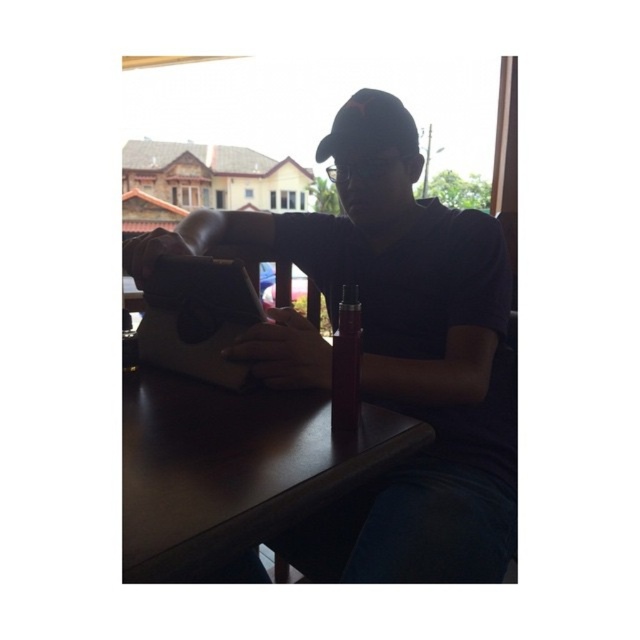
You are a delivery person who needs to place a small package on the dark wood table at center. However, there is a matte black laptop at center already on it. Can you place the package on the table without moving the laptop?

The matte black laptop at center is above the dark wood table at center, so there is space beneath the laptop to place the package. However, since the laptop is already on the table, you would need to move it to make space for the package unless the package can be placed underneath, which might not be practical. Therefore, you should move the laptop to place the package on the dark wood table at center.

You are trying to place a matte black laptop at center on top of the dark wood table at center. Will it fit without hanging over the edges?

The matte black laptop at center has a greater height compared to dark wood table at center, so placing it on top would not be possible since the laptop is taller than the table itself.